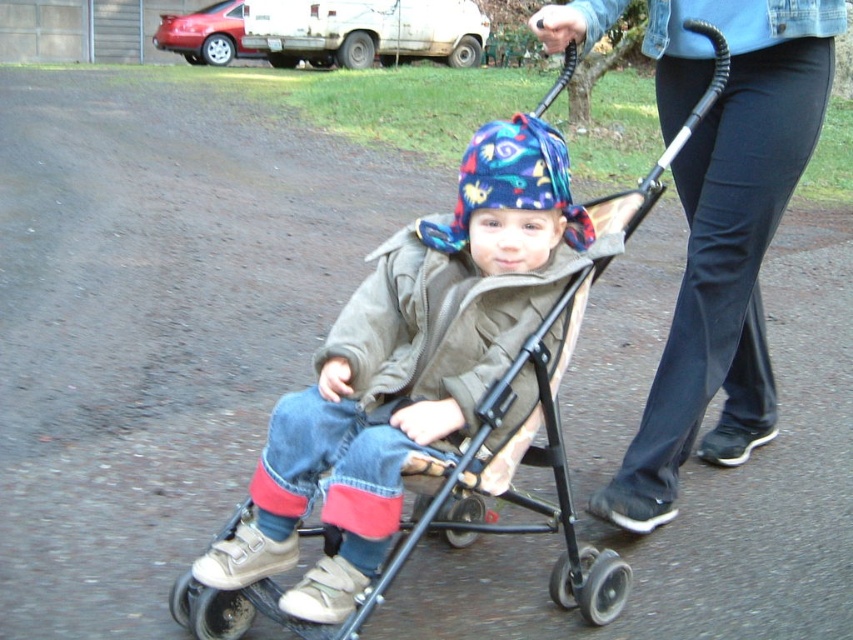
Question: Which point is closer to the camera taking this photo?

Choices:
 (A) (474, 532)
 (B) (428, 221)

Answer: (B)

Question: Does metallic stroller at center lie in front of multicolored fabric hat at center?

Choices:
 (A) yes
 (B) no

Answer: (A)

Question: Is denim pants at center wider than metallic stroller at center?

Choices:
 (A) no
 (B) yes

Answer: (A)

Question: Can you confirm if denim pants at center is positioned below metallic stroller at center?

Choices:
 (A) no
 (B) yes

Answer: (A)

Question: Which of the following is the closest to the observer?

Choices:
 (A) (607, 563)
 (B) (784, 36)
 (C) (512, 173)

Answer: (C)

Question: Which point is farther from the camera taking this photo?

Choices:
 (A) 708,156
 (B) 231,525

Answer: (A)